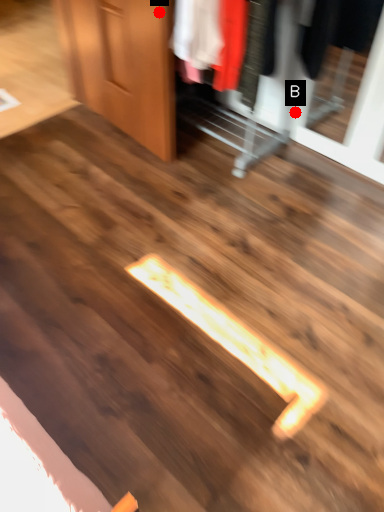
Question: Two points are circled on the image, labeled by A and B beside each circle. Which point is farther to the camera?

Choices:
 (A) A is further
 (B) B is further

Answer: (B)